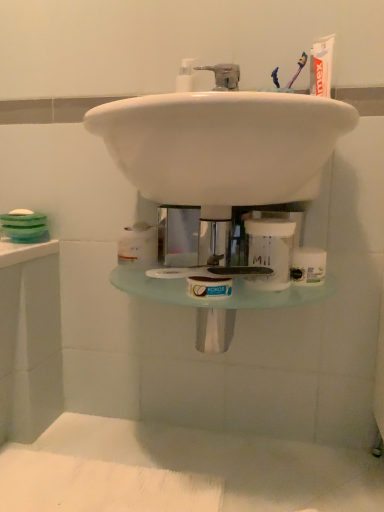
Question: From their relative heights in the image, would you say white glossy sink at center is taller or shorter than white matte jar at center?

Choices:
 (A) tall
 (B) short

Answer: (A)

Question: Considering their positions, is white glossy sink at center located in front of or behind white matte jar at center?

Choices:
 (A) front
 (B) behind

Answer: (A)

Question: From the image's perspective, is white glossy sink at center located above or below white matte jar at center?

Choices:
 (A) above
 (B) below

Answer: (A)

Question: Relative to white glossy sink at center, is white matte jar at center in front or behind?

Choices:
 (A) front
 (B) behind

Answer: (B)

Question: Considering the positions of point (292, 226) and point (291, 126), is point (292, 226) closer or farther from the camera than point (291, 126)?

Choices:
 (A) closer
 (B) farther

Answer: (B)

Question: From the image's perspective, is white matte jar at center located above or below white glossy sink at center?

Choices:
 (A) below
 (B) above

Answer: (A)

Question: From a real-world perspective, is white matte jar at center physically located above or below white glossy sink at center?

Choices:
 (A) above
 (B) below

Answer: (B)